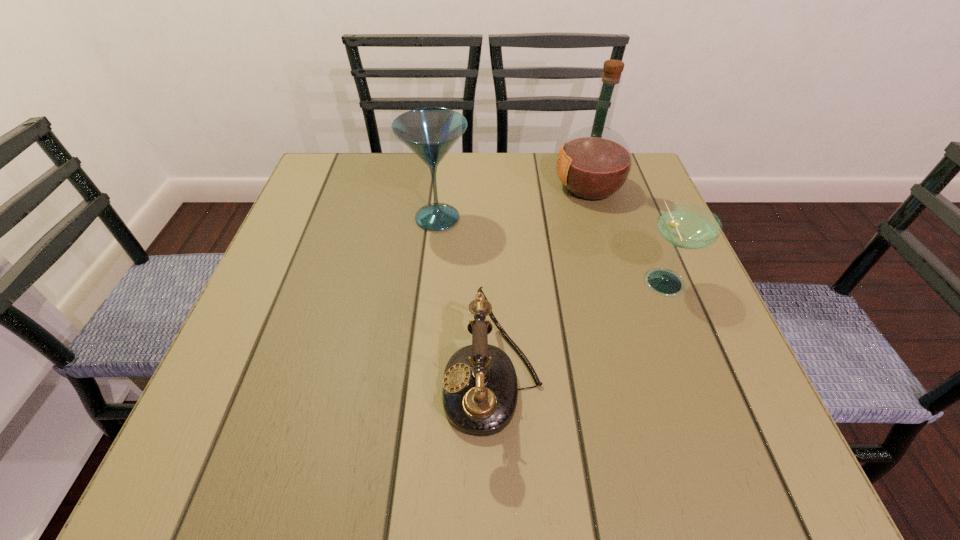
Where is `free space at the far edge of the desktop`? Image resolution: width=960 pixels, height=540 pixels. free space at the far edge of the desktop is located at coordinates (486, 155).

This screenshot has width=960, height=540. I want to click on blank space at the near edge, so click(570, 453).

The height and width of the screenshot is (540, 960). Find the location of `vacant position at the left edge of the desktop`. vacant position at the left edge of the desktop is located at coordinates (348, 251).

Image resolution: width=960 pixels, height=540 pixels. I want to click on vacant region at the right edge, so click(x=689, y=375).

Locate an element on the screen. The height and width of the screenshot is (540, 960). vacant space at the far left corner of the desktop is located at coordinates (364, 194).

This screenshot has width=960, height=540. I want to click on vacant point at the far right corner, so click(x=635, y=157).

This screenshot has width=960, height=540. I want to click on vacant region at the near right corner of the desktop, so click(708, 463).

Where is `vacant area that lies between the second tallest object and the liquor`? vacant area that lies between the second tallest object and the liquor is located at coordinates (513, 202).

You are a GUI agent. You are given a task and a screenshot of the screen. Output one action in this format:
    pyautogui.click(x=<x>, y=<y>)
    Task: Click on the free space that is in between the tallest object and the shorter martini
    
    Given the screenshot: What is the action you would take?
    pyautogui.click(x=626, y=234)

In order to click on free point between the third shortest object and the second nearest object in this screenshot , I will do pyautogui.click(x=550, y=249).